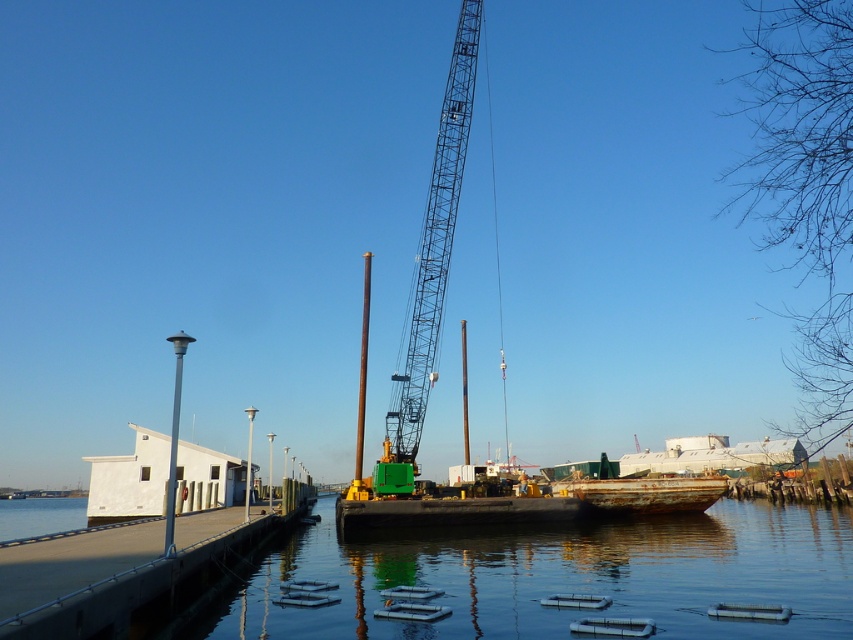
Question: Which object is farther from the camera taking this photo?

Choices:
 (A) rusty metal boat at lower right
 (B) concrete dock at lower left
 (C) metallic blue crane at center
 (D) clear water at dock center

Answer: (A)

Question: Can you confirm if metallic blue crane at center is bigger than rusty metal boat at lower right?

Choices:
 (A) no
 (B) yes

Answer: (B)

Question: Which of the following is the closest to the observer?

Choices:
 (A) metallic blue crane at center
 (B) clear water at dock center
 (C) concrete dock at lower left

Answer: (C)

Question: Among these points, which one is farthest from the camera?

Choices:
 (A) (604, 492)
 (B) (527, 548)

Answer: (A)

Question: Does concrete dock at lower left appear on the right side of metallic blue crane at center?

Choices:
 (A) no
 (B) yes

Answer: (A)

Question: Can you confirm if clear water at dock center is positioned to the right of rusty metal boat at lower right?

Choices:
 (A) yes
 (B) no

Answer: (B)